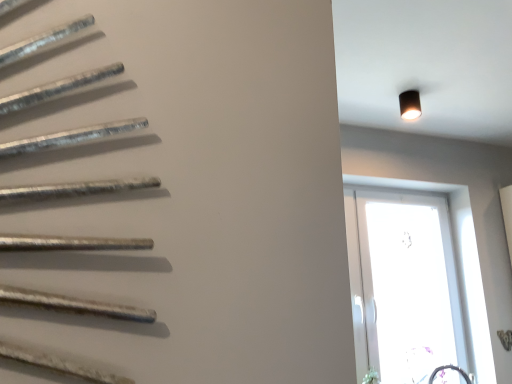
Question: From the image's perspective, is black matte light fixture at upper right on top of transparent glass window at right?

Choices:
 (A) no
 (B) yes

Answer: (B)

Question: Can you confirm if black matte light fixture at upper right is wider than transparent glass window at right?

Choices:
 (A) yes
 (B) no

Answer: (A)

Question: Is black matte light fixture at upper right facing away from transparent glass window at right?

Choices:
 (A) no
 (B) yes

Answer: (A)

Question: Is black matte light fixture at upper right smaller than transparent glass window at right?

Choices:
 (A) yes
 (B) no

Answer: (A)

Question: Is black matte light fixture at upper right to the left of transparent glass window at right from the viewer's perspective?

Choices:
 (A) yes
 (B) no

Answer: (A)

Question: From the image's perspective, is black matte light fixture at upper right below transparent glass window at right?

Choices:
 (A) yes
 (B) no

Answer: (B)

Question: From a real-world perspective, is transparent glass window at right positioned under black matte light fixture at upper right based on gravity?

Choices:
 (A) yes
 (B) no

Answer: (A)

Question: Does transparent glass window at right have a greater height compared to black matte light fixture at upper right?

Choices:
 (A) no
 (B) yes

Answer: (B)

Question: Is transparent glass window at right closer to the viewer compared to black matte light fixture at upper right?

Choices:
 (A) no
 (B) yes

Answer: (A)

Question: From the image's perspective, does transparent glass window at right appear lower than black matte light fixture at upper right?

Choices:
 (A) no
 (B) yes

Answer: (B)

Question: Considering the relative sizes of transparent glass window at right and black matte light fixture at upper right in the image provided, is transparent glass window at right thinner than black matte light fixture at upper right?

Choices:
 (A) yes
 (B) no

Answer: (A)

Question: Does transparent glass window at right have a larger size compared to black matte light fixture at upper right?

Choices:
 (A) yes
 (B) no

Answer: (A)

Question: From a real-world perspective, is transparent glass window at right physically located above or below black matte light fixture at upper right?

Choices:
 (A) below
 (B) above

Answer: (A)